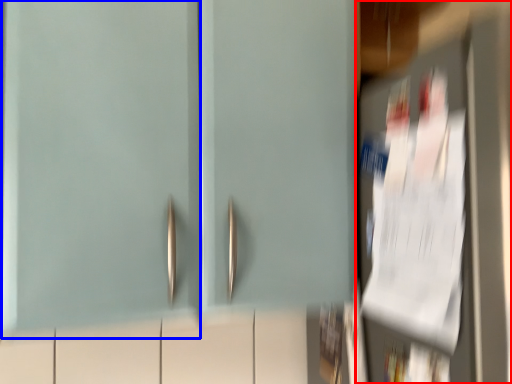
Question: Among these objects, which one is nearest to the camera, door (highlighted by a red box) or door (highlighted by a blue box)?

Choices:
 (A) door
 (B) door

Answer: (A)